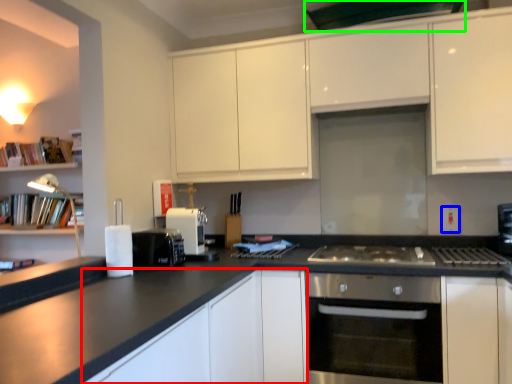
Question: Considering the real-world distances, which object is farthest from cabinetry (highlighted by a red box)? electric outlet (highlighted by a blue box) or exhaust hood (highlighted by a green box)?

Choices:
 (A) electric outlet
 (B) exhaust hood

Answer: (B)